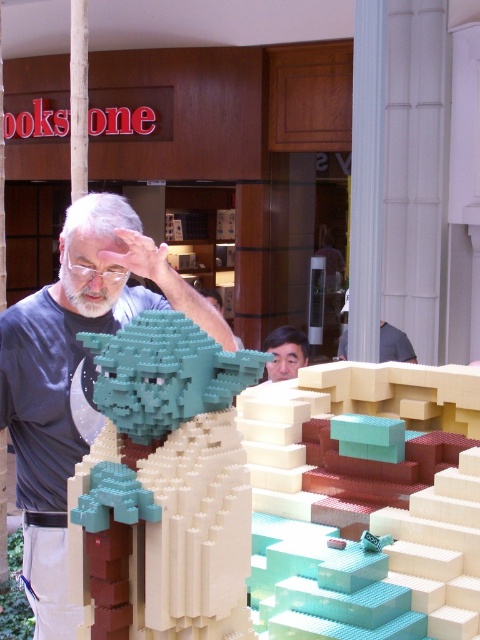
Who is positioned more to the right, teal matte lego figure at center or matte gray shirt at center?

teal matte lego figure at center is more to the right.

Does teal matte lego figure at center have a greater width compared to matte gray shirt at center?

No, teal matte lego figure at center is not wider than matte gray shirt at center.

Does point (123, 552) come in front of point (118, 268)?

Yes.

Locate an element on the screen. This screenshot has height=640, width=480. teal matte lego figure at center is located at coordinates (166, 484).

Between teal matte lego figure at center and smooth skin face at center, which one is positioned lower?

teal matte lego figure at center is below.

Locate an element on the screen. teal matte lego figure at center is located at coordinates (166, 484).

Does matte gray shirt at center have a greater width compared to smooth skin face at center?

Yes, matte gray shirt at center is wider than smooth skin face at center.

Between point (88, 248) and point (266, 365), which one is positioned in front?

Point (88, 248) is in front.

You are a GUI agent. You are given a task and a screenshot of the screen. Output one action in this format:
    pyautogui.click(x=<x>, y=<y>)
    Task: Click on the matte gray shirt at center
    This screenshot has width=480, height=640.
    Given the screenshot: What is the action you would take?
    pyautogui.click(x=74, y=376)